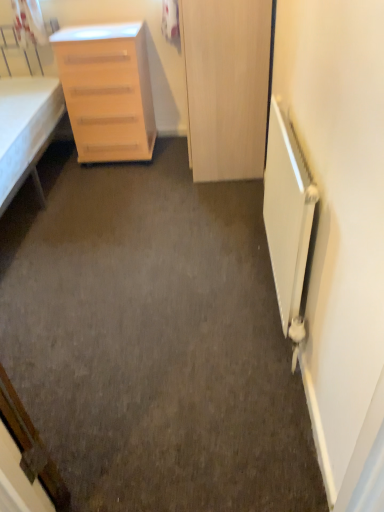
Image resolution: width=384 pixels, height=512 pixels. I want to click on free space above light wood/finely finished chest of drawers at left (from a real-world perspective), so click(92, 31).